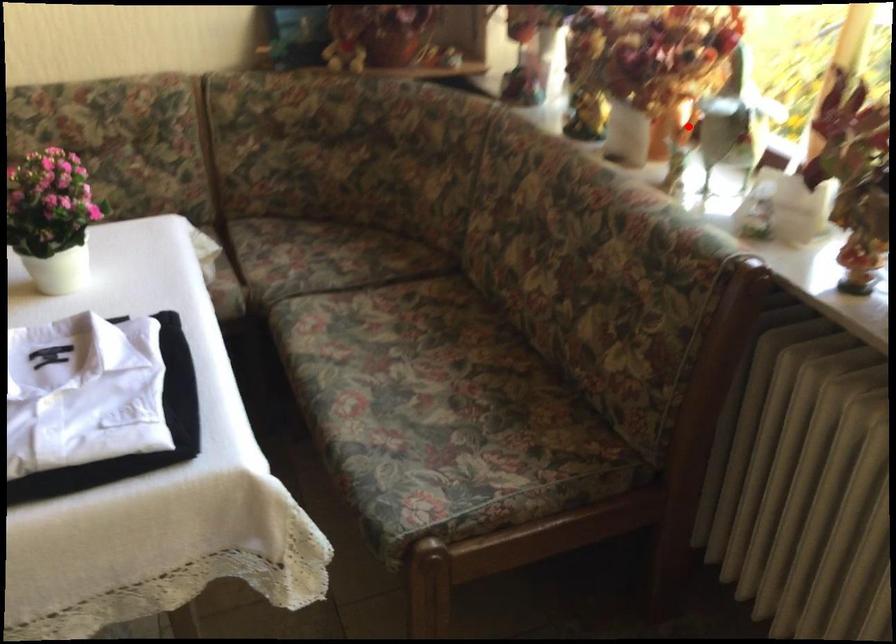
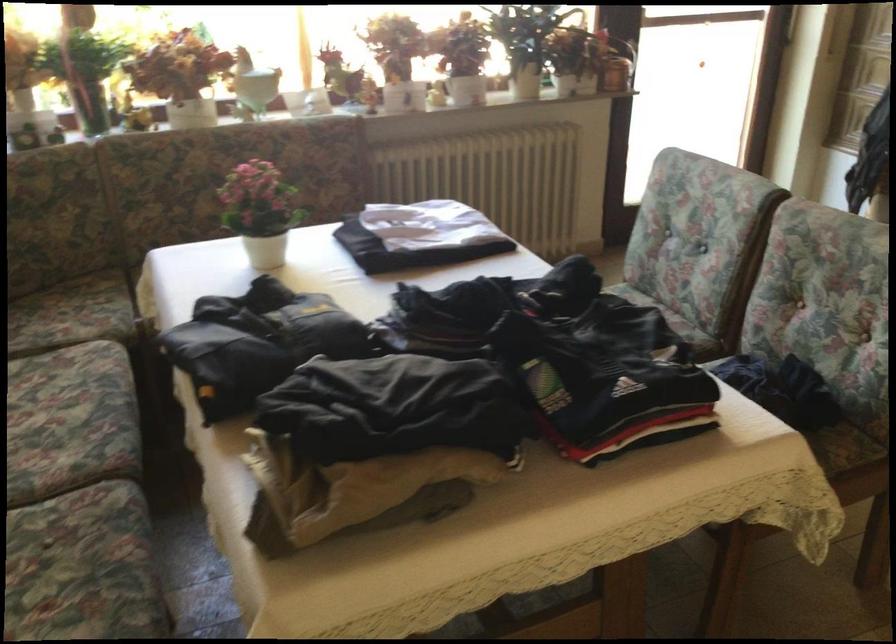
Question: I am providing you with two images of the same scene from different viewpoints. In image1, a red point is highlighted. Considering the same 3D point in image2, which of the following is correct?

Choices:
 (A) It is closer
 (B) It is farther

Answer: (B)